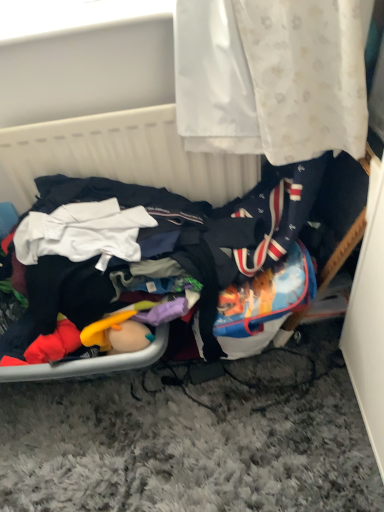
The image size is (384, 512). Identify the location of white fabric basket at upper center. (121, 156).

Measure the distance between white fabric basket at upper center and camera.

white fabric basket at upper center is 1.13 meters from camera.

What do you see at coordinates (121, 156) in the screenshot?
I see `white fabric basket at upper center` at bounding box center [121, 156].

What is the approximate width of multicolored fabric pile at lower left?

multicolored fabric pile at lower left is 16.82 inches in width.

Where is `multicolored fabric pile at lower left`? multicolored fabric pile at lower left is located at coordinates (169, 264).

What do you see at coordinates (169, 264) in the screenshot? I see `multicolored fabric pile at lower left` at bounding box center [169, 264].

In order to click on white fabric basket at upper center in this screenshot , I will do `click(121, 156)`.

Is white fabric basket at upper center to the left or to the right of multicolored fabric pile at lower left in the image?

Clearly, white fabric basket at upper center is on the left of multicolored fabric pile at lower left in the image.

Is white fabric basket at upper center behind multicolored fabric pile at lower left?

Yes, the depth of white fabric basket at upper center is greater than that of multicolored fabric pile at lower left.

Is point (164, 186) positioned after point (204, 271)?

Yes, point (164, 186) is behind point (204, 271).

From the image's perspective, is white fabric basket at upper center beneath multicolored fabric pile at lower left?

No, from the image's perspective, white fabric basket at upper center is not below multicolored fabric pile at lower left.

Based on the photo, from a real-world perspective, is white fabric basket at upper center above or below multicolored fabric pile at lower left?

Clearly, from a real-world perspective, white fabric basket at upper center is above multicolored fabric pile at lower left.

Which of these two, white fabric basket at upper center or multicolored fabric pile at lower left, is thinner?

white fabric basket at upper center.

Which of these two, white fabric basket at upper center or multicolored fabric pile at lower left, stands taller?

white fabric basket at upper center.

Considering the relative sizes of white fabric basket at upper center and multicolored fabric pile at lower left in the image provided, is white fabric basket at upper center bigger than multicolored fabric pile at lower left?

No, white fabric basket at upper center is not bigger than multicolored fabric pile at lower left.

Would you say multicolored fabric pile at lower left is part of white fabric basket at upper center's contents?

No, multicolored fabric pile at lower left is not surrounded by white fabric basket at upper center.

In the scene shown: Is white fabric basket at upper center next to multicolored fabric pile at lower left and touching it?

No, white fabric basket at upper center is not touching multicolored fabric pile at lower left.

Could you tell me if white fabric basket at upper center is turned towards multicolored fabric pile at lower left?

Yes, white fabric basket at upper center is oriented towards multicolored fabric pile at lower left.

Identify the location of clothing below the white fabric basket at upper center (from the image's perspective). The width and height of the screenshot is (384, 512). (169, 264).

Between multicolored fabric pile at lower left and white fabric basket at upper center, which one appears on the left side from the viewer's perspective?

Positioned to the left is white fabric basket at upper center.

Which object is closer to the camera taking this photo, multicolored fabric pile at lower left or white fabric basket at upper center?

multicolored fabric pile at lower left is closer to the camera.

Is point (30, 361) closer or farther from the camera than point (139, 147)?

Point (30, 361) is positioned closer to the camera compared to point (139, 147).

From the image's perspective, is multicolored fabric pile at lower left above or below white fabric basket at upper center?

From the image's perspective, multicolored fabric pile at lower left appears below white fabric basket at upper center.

From a real-world perspective, is multicolored fabric pile at lower left positioned over white fabric basket at upper center based on gravity?

No, from a real-world perspective, multicolored fabric pile at lower left is not above white fabric basket at upper center.

In the scene shown: Considering the relative sizes of multicolored fabric pile at lower left and white fabric basket at upper center in the image provided, is multicolored fabric pile at lower left wider than white fabric basket at upper center?

Yes, multicolored fabric pile at lower left is wider than white fabric basket at upper center.

Considering the sizes of multicolored fabric pile at lower left and white fabric basket at upper center in the image, is multicolored fabric pile at lower left taller or shorter than white fabric basket at upper center?

Clearly, multicolored fabric pile at lower left is shorter compared to white fabric basket at upper center.

Does multicolored fabric pile at lower left have a smaller size compared to white fabric basket at upper center?

No.

Is white fabric basket at upper center a part of multicolored fabric pile at lower left?

No, multicolored fabric pile at lower left does not contain white fabric basket at upper center.

Can you see multicolored fabric pile at lower left touching white fabric basket at upper center?

No, multicolored fabric pile at lower left is not with white fabric basket at upper center.

Could you tell me if multicolored fabric pile at lower left is turned towards white fabric basket at upper center?

Yes, multicolored fabric pile at lower left is facing white fabric basket at upper center.

Find the location of a particular element. clothing below the white fabric basket at upper center (from the image's perspective) is located at coordinates (169, 264).

The image size is (384, 512). In order to click on basket on the left of multicolored fabric pile at lower left in this screenshot , I will do `click(121, 156)`.

You are a GUI agent. You are given a task and a screenshot of the screen. Output one action in this format:
    pyautogui.click(x=<x>, y=<y>)
    Task: Click on the basket located above the multicolored fabric pile at lower left (from a real-world perspective)
    This screenshot has height=512, width=384.
    Given the screenshot: What is the action you would take?
    pyautogui.click(x=121, y=156)